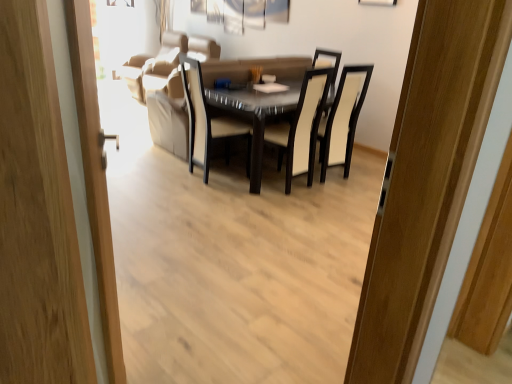
Question: Based on their sizes in the image, would you say black leather chair at center, arranged as the 2th chair when viewed from the left, is bigger or smaller than beige fabric chair at center, placed as the second chair when sorted from right to left?

Choices:
 (A) small
 (B) big

Answer: (B)

Question: Looking at their shapes, would you say black leather chair at center, arranged as the 2th chair when viewed from the left, is wider or thinner than beige fabric chair at center, the first chair viewed from the left?

Choices:
 (A) wide
 (B) thin

Answer: (A)

Question: Estimate the real-world distances between objects in this image. Which object is farther from the suede beige couch at upper center?

Choices:
 (A) glossy glass table at center
 (B) beige fabric chair at center, the first chair viewed from the left
 (C) white fabric curtain at upper center
 (D) black leather chair at center, arranged as the 2th chair when viewed from the left
 (E) wooden door at left

Answer: (E)

Question: Which object is the farthest from the wooden door at left?

Choices:
 (A) suede beige couch at upper center
 (B) glossy glass table at center
 (C) beige fabric chair at center, the first chair viewed from the left
 (D) white fabric curtain at upper center
 (E) black leather chair at center, the first chair from the right

Answer: (D)